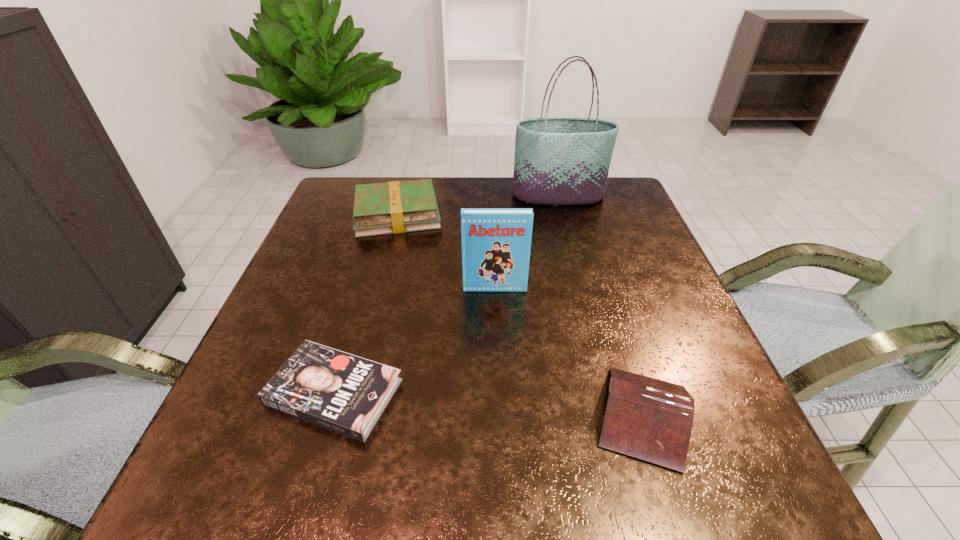
Identify the location of the tallest object. (558, 160).

Find the location of a particular element. The height and width of the screenshot is (540, 960). the second tallest object is located at coordinates (496, 242).

Identify the location of the second book from right to left. (496, 242).

This screenshot has width=960, height=540. What are the coordinates of `the farthest book` in the screenshot? It's located at (394, 207).

Identify the location of the rightmost book. (649, 419).

This screenshot has width=960, height=540. I want to click on the shortest book, so click(347, 394).

The image size is (960, 540). What are the coordinates of `free space located 0.230m on the left of the tallest object` in the screenshot? It's located at (430, 196).

Locate an element on the screen. vacant space located on the front cover of the second farthest book is located at coordinates (496, 334).

You are a GUI agent. You are given a task and a screenshot of the screen. Output one action in this format:
    pyautogui.click(x=<x>, y=<y>)
    Task: Click on the free space located on the right of the farthest book
    
    Given the screenshot: What is the action you would take?
    pyautogui.click(x=481, y=215)

Identify the location of vacant space located on the left of the rightmost book. (388, 416).